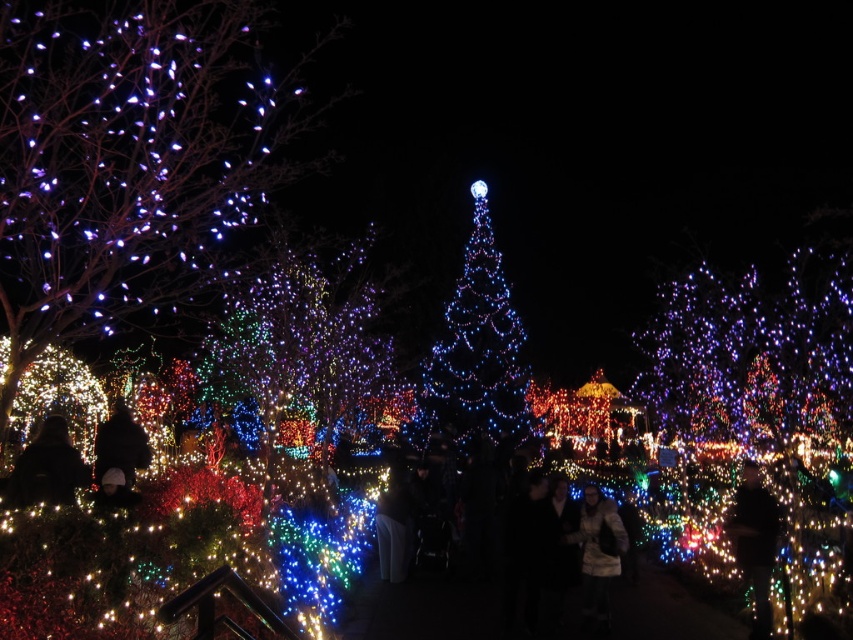
Who is taller, fuzzy brown coat at center or black fabric at lower left?

Standing taller between the two is fuzzy brown coat at center.

Consider the image. Who is lower down, fuzzy brown coat at center or black fabric at lower left?

fuzzy brown coat at center

Between point (602, 620) and point (68, 468), which one is positioned behind?

The point (602, 620) is behind.

Image resolution: width=853 pixels, height=640 pixels. I want to click on fuzzy brown coat at center, so click(x=598, y=554).

Can you confirm if fuzzy brown coat at center is taller than black matte jacket at lower left?

Correct, fuzzy brown coat at center is much taller as black matte jacket at lower left.

Measure the distance between fuzzy brown coat at center and camera.

A distance of 65.57 feet exists between fuzzy brown coat at center and camera.

This screenshot has height=640, width=853. I want to click on fuzzy brown coat at center, so click(598, 554).

Is illuminated plastic tree at left to the left of black matte jacket at lower left from the viewer's perspective?

Indeed, illuminated plastic tree at left is positioned on the left side of black matte jacket at lower left.

Can you confirm if illuminated plastic tree at left is positioned below black matte jacket at lower left?

No, illuminated plastic tree at left is not below black matte jacket at lower left.

Describe the element at coordinates (126, 161) in the screenshot. I see `illuminated plastic tree at left` at that location.

Locate an element on the screen. The height and width of the screenshot is (640, 853). illuminated plastic tree at left is located at coordinates (126, 161).